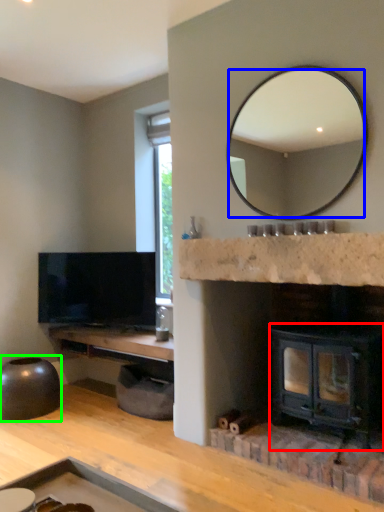
Question: Estimate the real-world distances between objects in this image. Which object is farther from wood burning stove (highlighted by a red box), mirror (highlighted by a blue box) or round table (highlighted by a green box)?

Choices:
 (A) mirror
 (B) round table

Answer: (A)